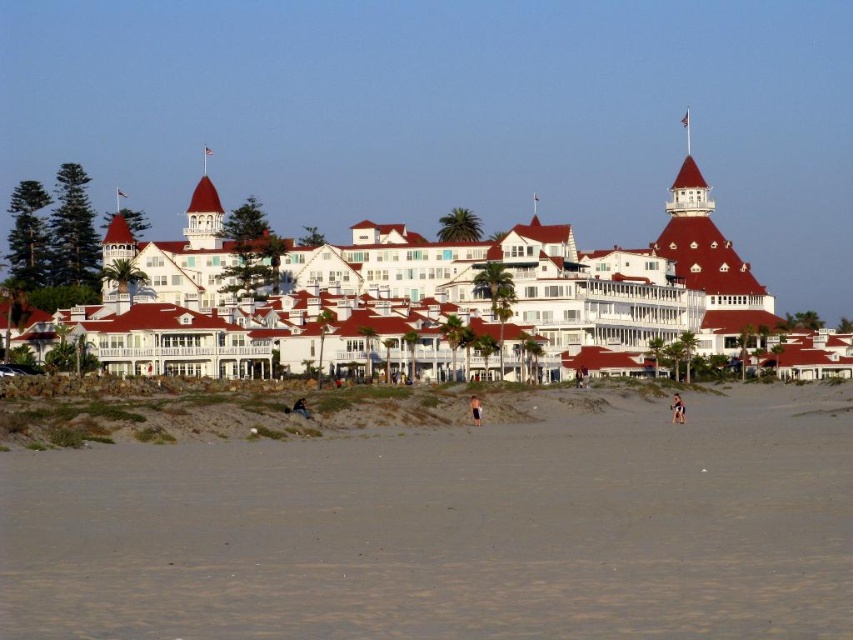
Question: Based on their relative distances, which object is nearer to the reddish-orange fabric shorts at lower right?

Choices:
 (A) tan skin person at center
 (B) gray sand at lower center

Answer: (A)

Question: Is gray sand at lower center above white wood resort at center?

Choices:
 (A) yes
 (B) no

Answer: (B)

Question: Can you confirm if reddish-orange fabric shorts at lower right is thinner than tan skin person at center?

Choices:
 (A) yes
 (B) no

Answer: (B)

Question: Estimate the real-world distances between objects in this image. Which object is farther from the brown leather jacket at center?

Choices:
 (A) white wood resort at center
 (B) reddish-orange fabric shorts at lower right
 (C) gray sand at lower center

Answer: (A)

Question: Which object is the closest to the white wood resort at center?

Choices:
 (A) brown leather jacket at center
 (B) gray sand at lower center
 (C) tan skin person at center

Answer: (B)

Question: Is gray sand at lower center wider than tan skin person at center?

Choices:
 (A) no
 (B) yes

Answer: (B)